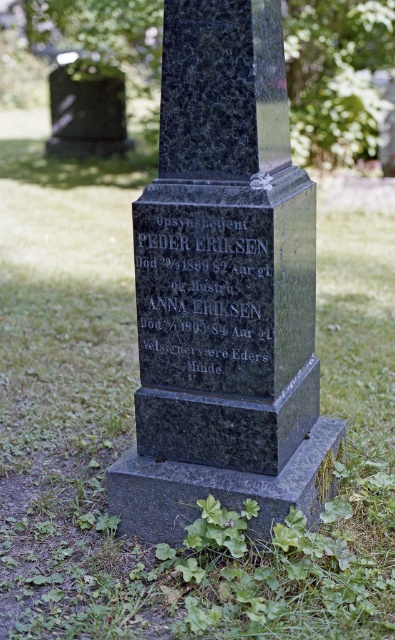
Question: Is green polished stone monument at center wider than black granite stone at center?

Choices:
 (A) yes
 (B) no

Answer: (A)

Question: Which object appears farthest from the camera in this image?

Choices:
 (A) black granite stone at center
 (B) green polished stone monument at center

Answer: (A)

Question: Which point is closer to the camera?

Choices:
 (A) black granite stone at center
 (B) green polished stone monument at center

Answer: (B)

Question: Is green polished stone monument at center smaller than black granite stone at center?

Choices:
 (A) no
 (B) yes

Answer: (A)

Question: Does green polished stone monument at center appear under black granite stone at center?

Choices:
 (A) no
 (B) yes

Answer: (A)